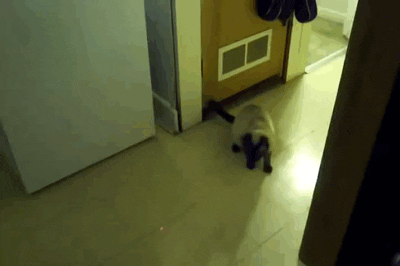
Identify the location of wall. (181, 33), (295, 41).